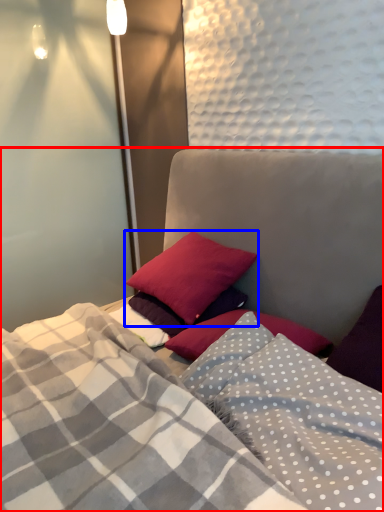
Question: Which point is further to the camera, bed (highlighted by a red box) or pillow (highlighted by a blue box)?

Choices:
 (A) bed
 (B) pillow

Answer: (B)